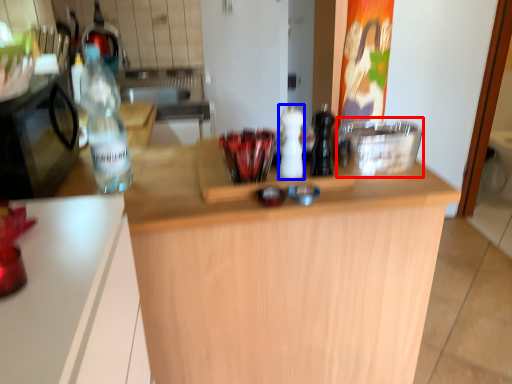
Question: Which object appears closest to the camera in this image, appliance (highlighted by a red box) or bottle (highlighted by a blue box)?

Choices:
 (A) appliance
 (B) bottle

Answer: (B)